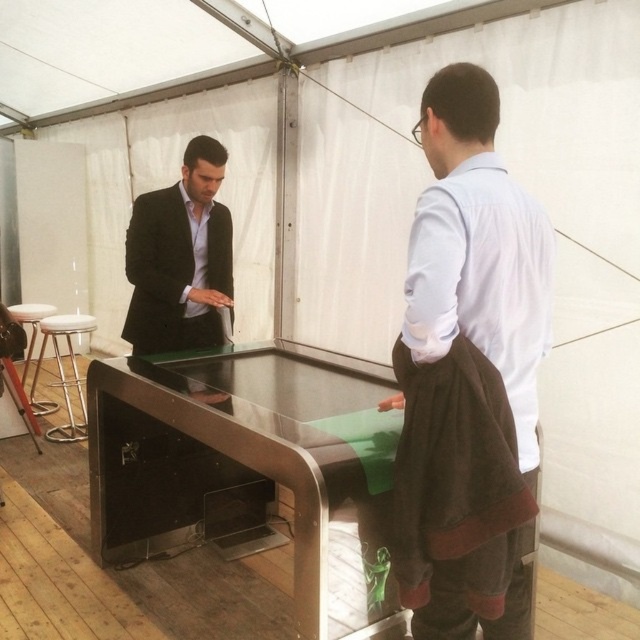
You are standing at the back of the tent and want to see the brown woolen sweater at center through the transparent glass table at center. Can you see the sweater clearly through the table?

The transparent glass table at center is not as tall as brown woolen sweater at center, so the sweater is taller than the table. This means the sweater would be visible above the table, allowing you to see it clearly through the transparent glass table at center.

You are standing at the entrance of the tent and want to approach the transparent glass table at center. Which direction should you move to reach it first, left or right?

The transparent glass table at center is located at point (240, 467), which is closer to the right side of the frame. Therefore, you should move to the right to reach it first.

You are a photographer setting up for an event inside the tent. You need to position a 1.2 meter tall tripod between the transparent glass table at center and the white leather stool at left. Will the tripod fit vertically between them without touching either object?

The transparent glass table at center is taller than the white leather stool at left. Since the tripod is 1.2 meters tall, it may not fit vertically between them if the table is taller than the stool and the space between them is limited. However, without specific distance information, we can only confirm the height relationship. The tripod might need to be placed elsewhere.